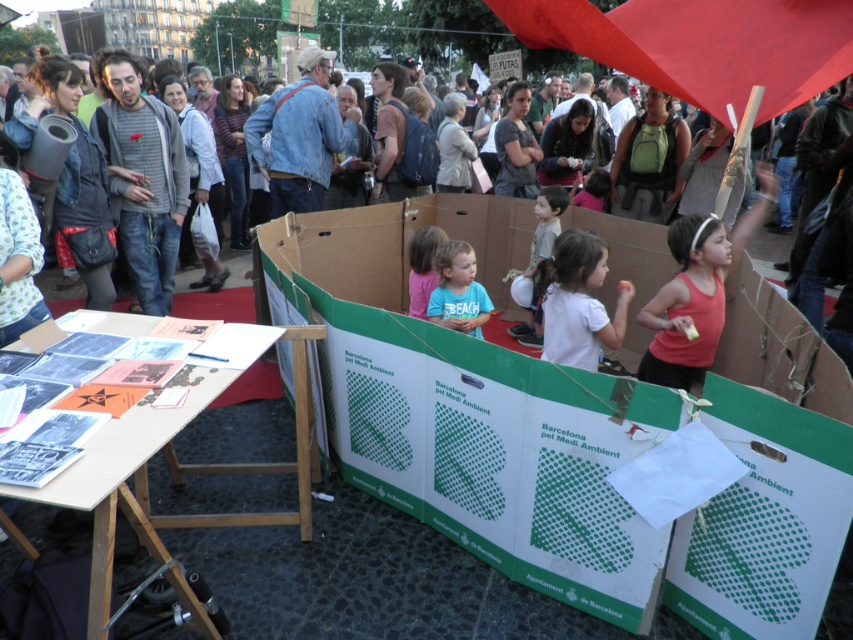
You are organizing a community event and need to place a 1.5 meter wide banner between the wooden table at lower left and the blue cotton shirt at center. Can the space accommodate the banner?

The wooden table at lower left is bigger than the blue cotton shirt at center, but the exact distance between them isn not specified. Without knowing the space between the two objects, it is impossible to determine if the banner will fit.

You are organizing a community event and need to place a 1.2 meter wide banner between the wooden table at lower left and the blue cotton shirt at center. Can the banner fit between them based on their widths?

The wooden table at lower left is wider than the blue cotton shirt at center. Since the banner is 1.2 meters wide, it depends on the actual width of the table and shirt. However, the description only states their relative sizes, not exact measurements. Therefore, we cannot definitively determine if the banner will fit.